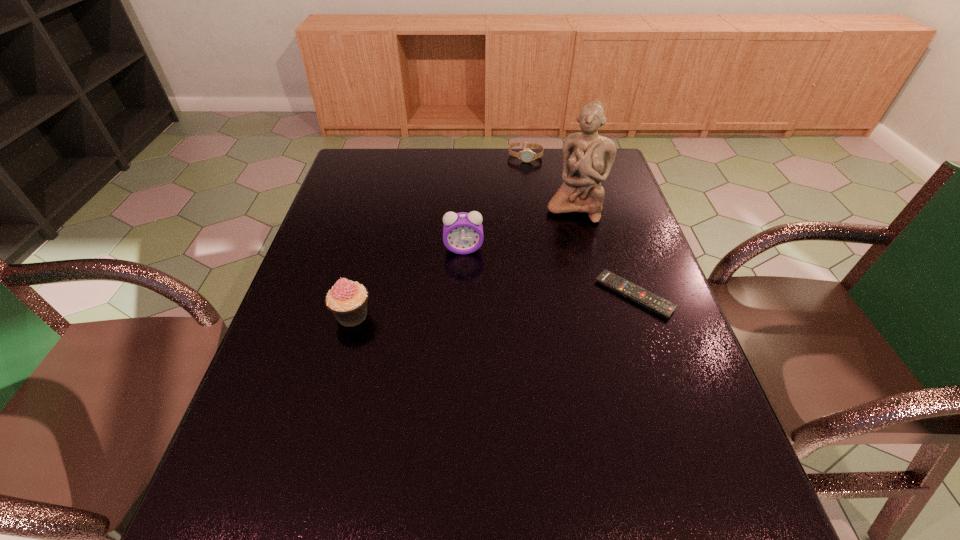
You are a GUI agent. You are given a task and a screenshot of the screen. Output one action in this format:
    pyautogui.click(x=<x>, y=<y>)
    Task: Click on the vacant spot on the desktop that is between the leftmost object and the remote control and is positioned on the face of the fourth object from right to left
    
    Given the screenshot: What is the action you would take?
    pyautogui.click(x=465, y=307)

This screenshot has height=540, width=960. What are the coordinates of `free spot on the desktop that is between the cupcake and the shortest object and is positioned on the face of the watch` in the screenshot? It's located at (495, 305).

Image resolution: width=960 pixels, height=540 pixels. Find the location of `vacant spot on the desktop that is between the cupcake and the remote control and is positioned on the front-facing side of the figurine`. vacant spot on the desktop that is between the cupcake and the remote control and is positioned on the front-facing side of the figurine is located at coordinates (538, 302).